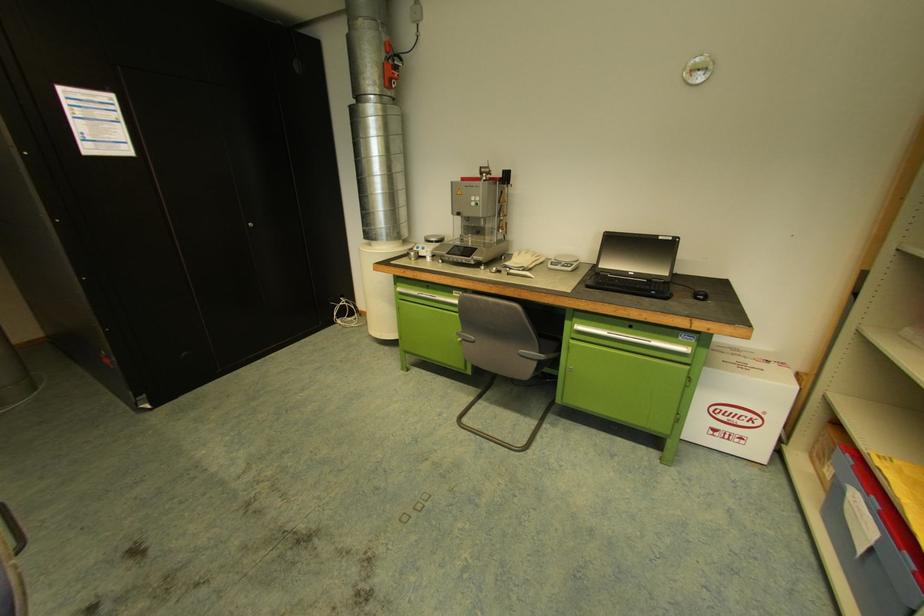
Image resolution: width=924 pixels, height=616 pixels. In order to click on white digital scale in this screenshot , I will do `click(469, 249)`.